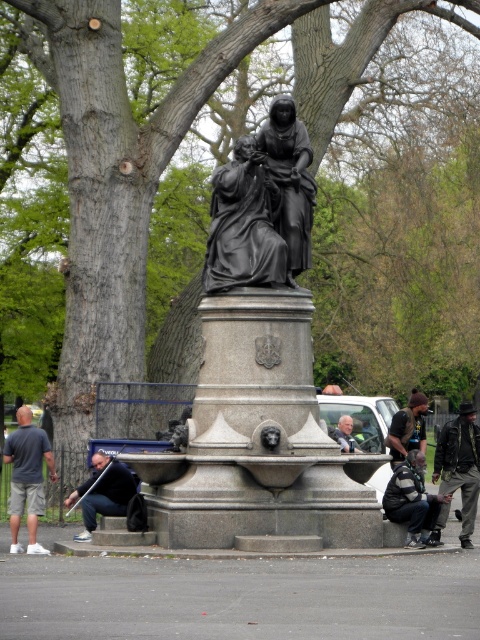
Question: Does polished bronze statue at center have a smaller size compared to dark gray cotton shirt at lower left?

Choices:
 (A) no
 (B) yes

Answer: (B)

Question: Which point is farther to the camera?

Choices:
 (A) (349, 435)
 (B) (100, 460)
 (C) (460, 477)
 (D) (262, 326)

Answer: (A)

Question: Does black polished statue at center appear over leather jacket at lower right?

Choices:
 (A) no
 (B) yes

Answer: (B)

Question: Based on their relative distances, which object is farther from the polished bronze statue at center?

Choices:
 (A) light brown leather jacket at center
 (B) leather jacket at lower right
 (C) dark gray fabric jacket at lower right
 (D) dark blue jeans at lower left

Answer: (C)

Question: Which object is the farthest from the dark gray fabric jacket at lower right?

Choices:
 (A) light brown leather jacket at center
 (B) polished bronze statue at center

Answer: (B)

Question: Does polished bronze statue at center have a smaller size compared to leather jacket at lower right?

Choices:
 (A) no
 (B) yes

Answer: (A)